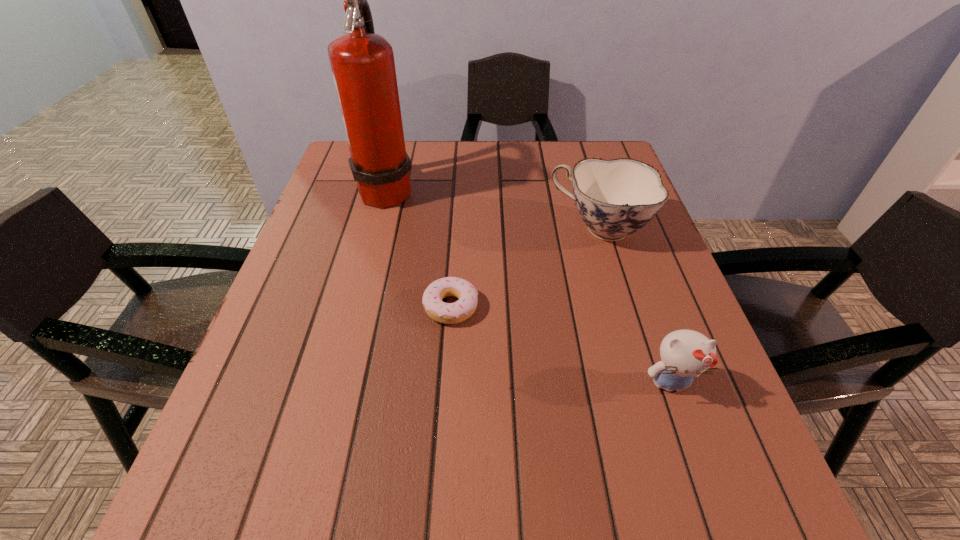
Image resolution: width=960 pixels, height=540 pixels. What are the coordinates of `unoccupied position between the fire extinguisher and the kitten` in the screenshot? It's located at (528, 286).

What are the coordinates of `free space that is in between the nearest object and the tallest object` in the screenshot? It's located at (528, 286).

I want to click on free space between the chinaware and the kitten, so click(635, 306).

Where is `free area in between the fire extinguisher and the doughnut`? free area in between the fire extinguisher and the doughnut is located at coordinates (419, 248).

The image size is (960, 540). Find the location of `vacant area that lies between the fire extinguisher and the kitten`. vacant area that lies between the fire extinguisher and the kitten is located at coordinates (528, 286).

Where is `free space between the second nearest object and the leftmost object`? This screenshot has width=960, height=540. free space between the second nearest object and the leftmost object is located at coordinates (419, 248).

Locate an element on the screen. This screenshot has height=540, width=960. free point between the nearest object and the chinaware is located at coordinates (635, 306).

I want to click on vacant point located between the nearest object and the third object from right to left, so click(x=561, y=345).

You are a GUI agent. You are given a task and a screenshot of the screen. Output one action in this format:
    pyautogui.click(x=<x>, y=<y>)
    Task: Click on the blank region between the shortest object and the chinaware
    
    Given the screenshot: What is the action you would take?
    pyautogui.click(x=525, y=267)

What are the coordinates of `free area in between the tallest object and the nearest object` in the screenshot? It's located at (528, 286).